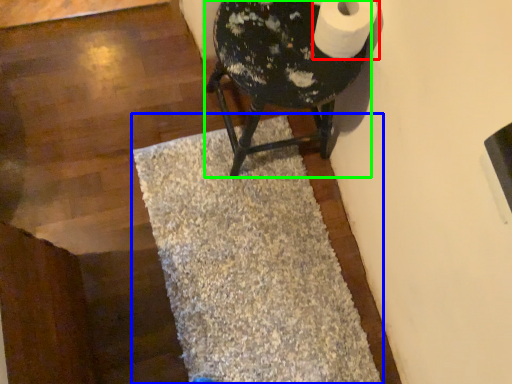
Question: Based on their relative distances, which object is farther from toilet paper (highlighted by a red box)? Choose from bath mat (highlighted by a blue box) and furniture (highlighted by a green box).

Choices:
 (A) bath mat
 (B) furniture

Answer: (A)